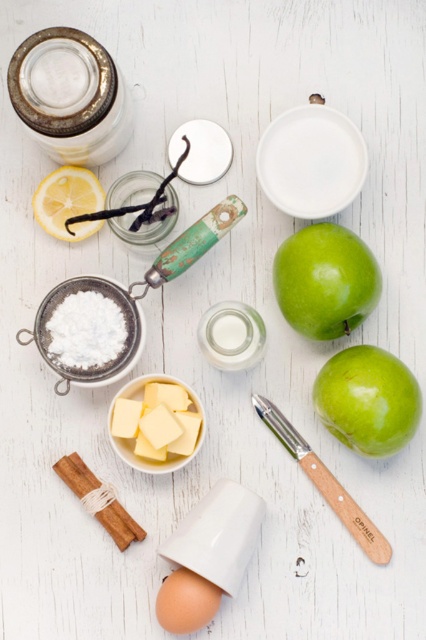
You are a chef preparing a dessert and need to choose between the green matte apple at lower right and the white powdered sugar at center left. Which object is larger in size?

The green matte apple at lower right is bigger than the white powdered sugar at center left according to the description.

From the picture: You are an assistant organizing items on a table. You need to place a new item at coordinate point 0.5, 0.9. Is the new item closer to the green matte apple at lower right or the edge of the table?

The green matte apple at lower right is at point (368, 401). The new item at (383, 320) is closer to the green matte apple at lower right than the edge of the table.

Consider the image. Where is the yellow butter at center located in the image?

The yellow butter at center is located at point 0.658 on the x axis and 0.371 on the y axis.